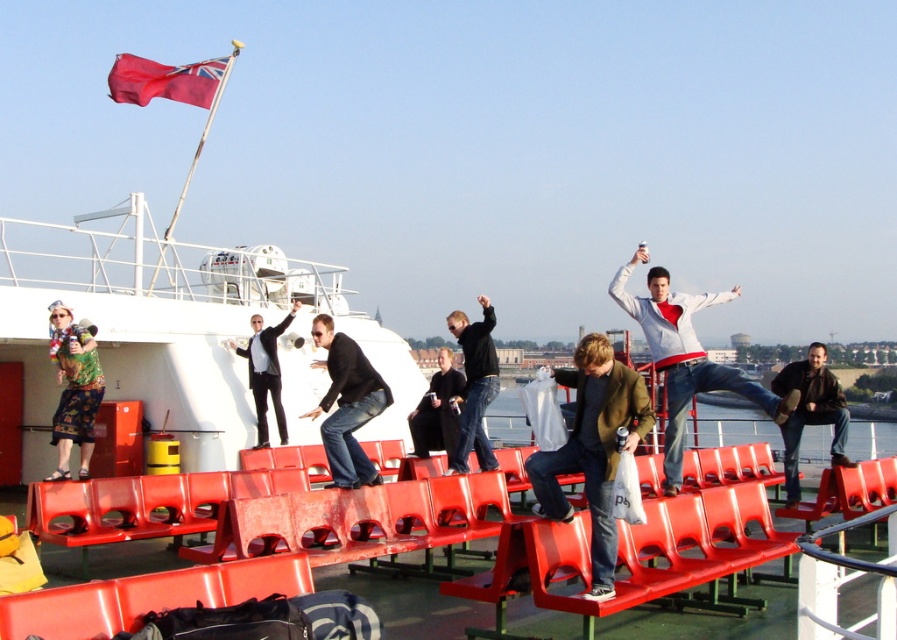
You are a photographer on the ferry deck and need to capture a photo of both the black leather jacket at center and the black smooth suit at center. However, the jacket is blocking the view of the suit. Can you adjust your angle to see the suit underneath without moving either item?

The black leather jacket at center is positioned over the black smooth suit at center, so you can adjust your angle slightly to see the suit underneath without moving either item.

You are a photographer positioned on the ferry deck. You need to capture a photo that includes both the printed fabric dress at upper left and the red fabric flag at upper left. Based on their positions, which object should you position closer to the left edge of your camera frame to ensure both are included?

The red fabric flag at upper left should be positioned closer to the left edge of the camera frame since the printed fabric dress at upper left is to the right of the red fabric flag at upper left.

You are a photographer on the ferry deck. You need to capture a photo that includes both the printed fabric dress at upper left and the red fabric flag at upper left. Which object should you focus on first to ensure both fit in the frame?

The printed fabric dress at upper left should be focused on first since it occupies less space than the red fabric flag at upper left, allowing more room to include both in the frame.